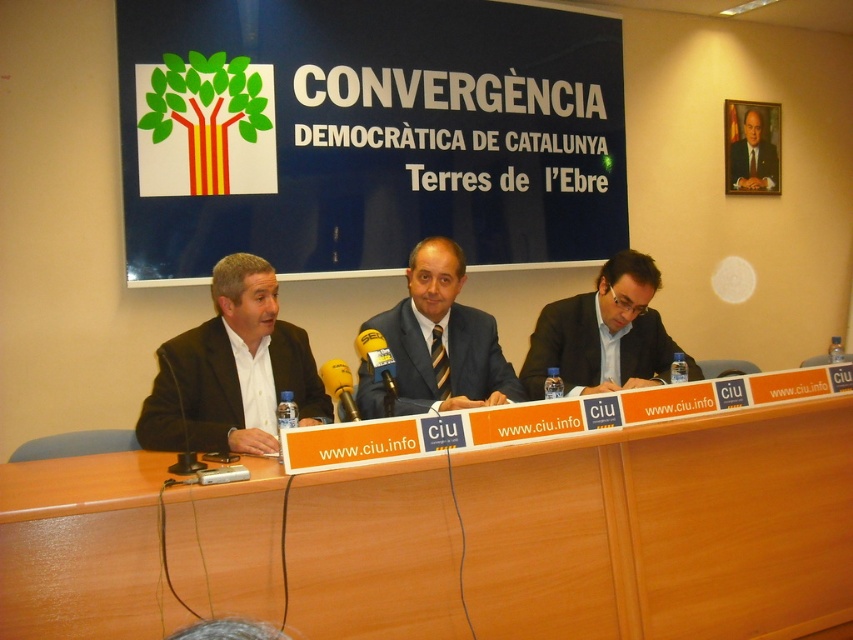
In the scene shown: Can you confirm if matte black suit at left is positioned to the left of metallic yellow microphone at center?

Yes, matte black suit at left is to the left of metallic yellow microphone at center.

Where is `matte black suit at left`? The height and width of the screenshot is (640, 853). matte black suit at left is located at coordinates (231, 371).

Between point (308, 355) and point (341, 417), which one is positioned in front?

Point (341, 417) is more forward.

Locate an element on the screen. matte black suit at left is located at coordinates (231, 371).

Can you confirm if matte black suit at center is taller than matte black suit at right?

Correct, matte black suit at center is much taller as matte black suit at right.

Is matte black suit at center bigger than matte black suit at right?

No.

Identify the location of matte black suit at center. The image size is (853, 640). (442, 339).

Describe the element at coordinates (546, 518) in the screenshot. I see `wooden at center` at that location.

Who is positioned more to the right, wooden at center or dark suit at center?

Positioned to the right is dark suit at center.

Is point (254, 554) closer to camera compared to point (775, 154)?

Yes, point (254, 554) is closer to viewer.

You are a GUI agent. You are given a task and a screenshot of the screen. Output one action in this format:
    pyautogui.click(x=<x>, y=<y>)
    Task: Click on the wooden at center
    This screenshot has height=640, width=853.
    Given the screenshot: What is the action you would take?
    pyautogui.click(x=546, y=518)